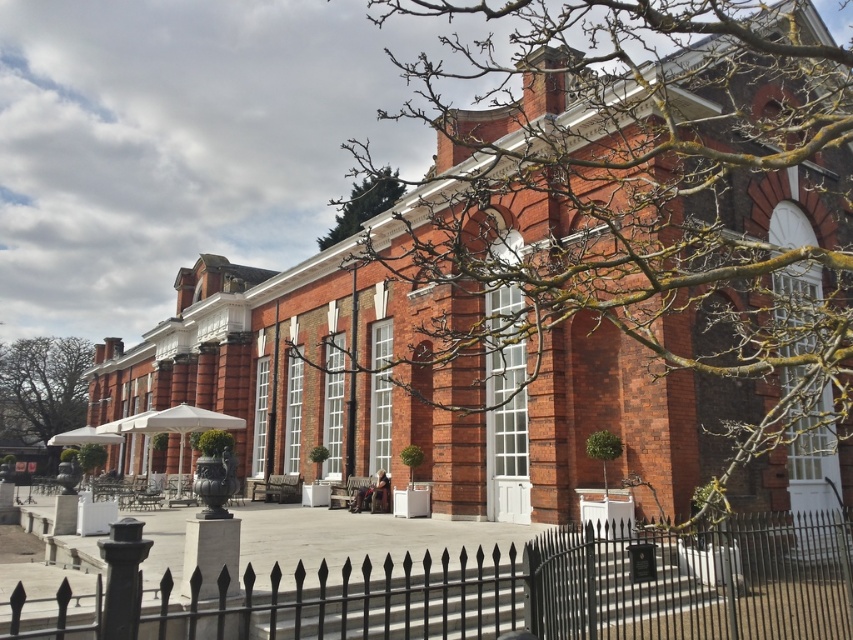
Question: Is green leafy tree at lower left positioned in front of green leafy tree at upper center?

Choices:
 (A) no
 (B) yes

Answer: (A)

Question: Among these points, which one is nearest to the camera?

Choices:
 (A) (83, 412)
 (B) (234, 579)

Answer: (B)

Question: Can you confirm if bare branches at center is thinner than green leafy tree at lower left?

Choices:
 (A) no
 (B) yes

Answer: (B)

Question: Does black wrought iron fence at lower center appear on the left side of green leafy tree at lower left?

Choices:
 (A) yes
 (B) no

Answer: (B)

Question: Which point is farther to the camera?

Choices:
 (A) black wrought iron fence at lower center
 (B) green leafy tree at upper center
 (C) bare branches at center
 (D) green leafy tree at lower left

Answer: (D)

Question: Which object appears farthest from the camera in this image?

Choices:
 (A) green leafy tree at upper center
 (B) bare branches at center
 (C) black wrought iron fence at lower center
 (D) green leafy tree at lower left

Answer: (D)